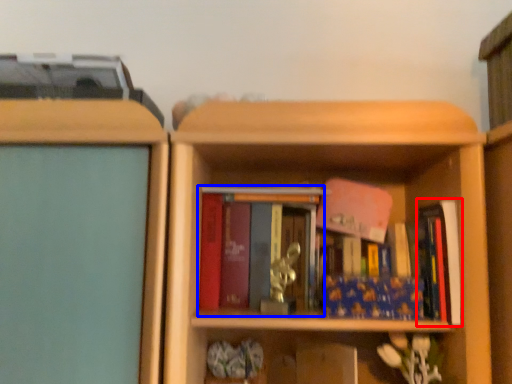
Question: Among these objects, which one is farthest to the camera, book (highlighted by a red box) or book (highlighted by a blue box)?

Choices:
 (A) book
 (B) book

Answer: (B)